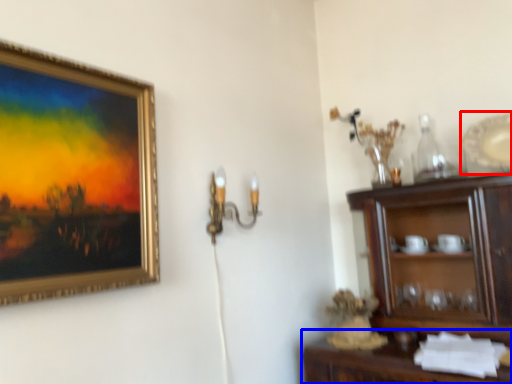
Question: Which of the following is the closest to the observer, platter (highlighted by a red box) or cabinetry (highlighted by a blue box)?

Choices:
 (A) platter
 (B) cabinetry

Answer: (B)